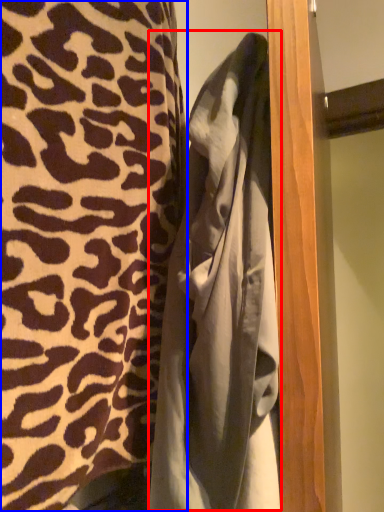
Question: Among these objects, which one is nearest to the camera, bathrobe (highlighted by a red box) or curtain (highlighted by a blue box)?

Choices:
 (A) bathrobe
 (B) curtain

Answer: (B)